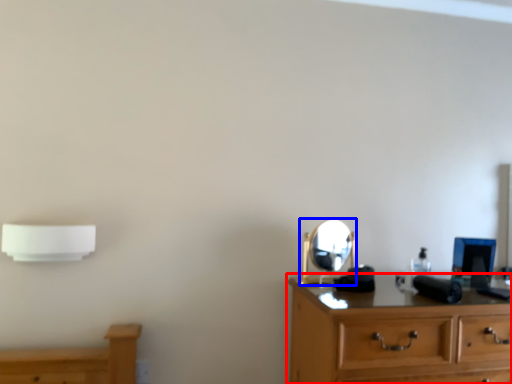
Question: Among these objects, which one is farthest to the camera, chest of drawers (highlighted by a red box) or mirror (highlighted by a blue box)?

Choices:
 (A) chest of drawers
 (B) mirror

Answer: (B)